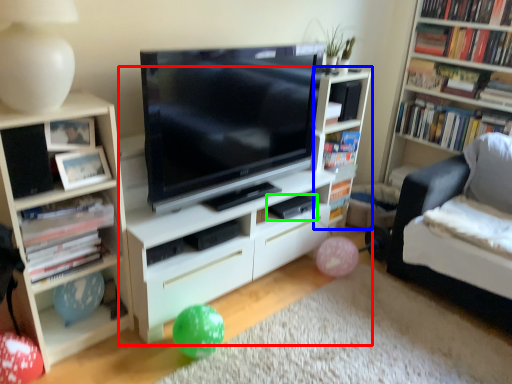
Question: Based on their relative distances, which object is nearer to shelf (highlighted by a red box)? Choose from shelf (highlighted by a blue box) and paperback book (highlighted by a green box).

Choices:
 (A) shelf
 (B) paperback book

Answer: (A)